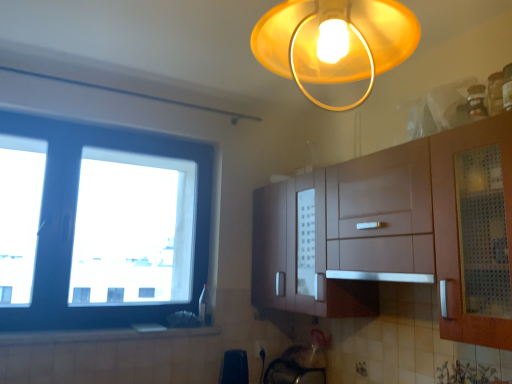
Where is `blue plastic window at left`? blue plastic window at left is located at coordinates (99, 224).

You are a GUI agent. You are given a task and a screenshot of the screen. Output one action in this format:
    pyautogui.click(x=<x>, y=<y>)
    Task: Click on the black plastic bag at lower center
    
    Given the screenshot: What is the action you would take?
    pyautogui.click(x=234, y=367)

In order to face white glossy electric outlet at lower center, should I rotate leftwards or rightwards?

Turn right approximately 0.881 degrees to face it.

The image size is (512, 384). What are the coordinates of `blue plastic window at left` in the screenshot? It's located at (99, 224).

Considering the relative sizes of matte yellow plastic lampshade at upper center and black plastic bag at lower center in the image provided, is matte yellow plastic lampshade at upper center smaller than black plastic bag at lower center?

No, matte yellow plastic lampshade at upper center is not smaller than black plastic bag at lower center.

Is matte yellow plastic lampshade at upper center surrounding black plastic bag at lower center?

No, matte yellow plastic lampshade at upper center does not contain black plastic bag at lower center.

Considering the sizes of objects matte yellow plastic lampshade at upper center and black plastic bag at lower center in the image provided, who is shorter, matte yellow plastic lampshade at upper center or black plastic bag at lower center?

black plastic bag at lower center is shorter.

Would you say white glossy electric outlet at lower center is inside or outside matte yellow plastic lampshade at upper center?

white glossy electric outlet at lower center is not inside matte yellow plastic lampshade at upper center, it's outside.

Is white glossy electric outlet at lower center looking in the opposite direction of matte yellow plastic lampshade at upper center?

No, white glossy electric outlet at lower center is not facing away from matte yellow plastic lampshade at upper center.

Which object is closer to the camera, white glossy electric outlet at lower center or matte yellow plastic lampshade at upper center?

matte yellow plastic lampshade at upper center is closer to the camera.

From the image's perspective, is white glossy electric outlet at lower center located above matte yellow plastic lampshade at upper center?

No.

Is black plastic bag at lower center closer to camera compared to satin silver exhaust hood at center?

No, it is not.

Based on the photo, could you tell me if black plastic bag at lower center is turned towards satin silver exhaust hood at center?

No, black plastic bag at lower center is not aimed at satin silver exhaust hood at center.

From a real-world perspective, is black plastic bag at lower center below satin silver exhaust hood at center?

Yes.

Considering the sizes of black plastic bag at lower center and satin silver exhaust hood at center in the image, is black plastic bag at lower center bigger or smaller than satin silver exhaust hood at center?

Considering their sizes, black plastic bag at lower center takes up less space than satin silver exhaust hood at center.

Which point is more forward, [264,22] or [31,342]?

The point [264,22] is more forward.

From the image's perspective, between matte yellow plastic lampshade at upper center and white glossy countertop at lower left, who is located below?

white glossy countertop at lower left, from the image's perspective.

Is matte yellow plastic lampshade at upper center oriented away from white glossy countertop at lower left?

No, matte yellow plastic lampshade at upper center is not facing the opposite direction of white glossy countertop at lower left.

Considering the sizes of objects blue plastic window at left and black plastic bag at lower center in the image provided, who is bigger, blue plastic window at left or black plastic bag at lower center?

Bigger between the two is blue plastic window at left.

Find the location of a particular element. window above the black plastic bag at lower center (from a real-world perspective) is located at coordinates (99, 224).

Based on the photo, can we say blue plastic window at left lies outside black plastic bag at lower center?

Yes, blue plastic window at left is outside of black plastic bag at lower center.

From the image's perspective, is blue plastic window at left located beneath black plastic bag at lower center?

Incorrect, from the image's perspective, blue plastic window at left is higher than black plastic bag at lower center.

How many degrees apart are the facing directions of white glossy countertop at lower left and white glossy electric outlet at lower center?

There is a 4.54-degree angle between the facing directions of white glossy countertop at lower left and white glossy electric outlet at lower center.

Locate an element on the screen. The width and height of the screenshot is (512, 384). counter top above the white glossy electric outlet at lower center (from the image's perspective) is located at coordinates pyautogui.click(x=99, y=335).

Is white glossy countertop at lower left spatially inside white glossy electric outlet at lower center, or outside of it?

white glossy countertop at lower left is not enclosed by white glossy electric outlet at lower center.

Could you measure the distance between white glossy countertop at lower left and white glossy electric outlet at lower center?

The distance of white glossy countertop at lower left from white glossy electric outlet at lower center is 29.12 inches.

Is matte yellow plastic lampshade at upper center positioned before white glossy electric outlet at lower center?

Yes, matte yellow plastic lampshade at upper center is in front of white glossy electric outlet at lower center.

Considering the relative sizes of matte yellow plastic lampshade at upper center and white glossy electric outlet at lower center in the image provided, is matte yellow plastic lampshade at upper center taller than white glossy electric outlet at lower center?

Indeed, matte yellow plastic lampshade at upper center has a greater height compared to white glossy electric outlet at lower center.

Is white glossy electric outlet at lower center at the back of matte yellow plastic lampshade at upper center?

No, matte yellow plastic lampshade at upper center is not facing the opposite direction of white glossy electric outlet at lower center.

Does matte yellow plastic lampshade at upper center have a greater width compared to white glossy electric outlet at lower center?

Yes.

The image size is (512, 384). Find the location of `lamp located on the right of black plastic bag at lower center`. lamp located on the right of black plastic bag at lower center is located at coordinates (335, 41).

At what (x,y) coordinates should I click in order to perform the action: click on electric outlet that appears on the left of matte yellow plastic lampshade at upper center. Please return your answer as a coordinate pair (x, y). Looking at the image, I should click on (260, 348).

Considering their positions, is matte yellow plastic lampshade at upper center positioned further to blue plastic window at left than white glossy countertop at lower left?

Based on the image, matte yellow plastic lampshade at upper center appears to be further to blue plastic window at left.

From the image, which object appears to be farther from blue plastic window at left, black plastic bag at lower center or white glossy countertop at lower left?

The object further to blue plastic window at left is black plastic bag at lower center.

Which object lies nearer to the anchor point white glossy electric outlet at lower center, blue plastic window at left or matte yellow plastic lampshade at upper center?

matte yellow plastic lampshade at upper center is closer to white glossy electric outlet at lower center.

Which object lies nearer to the anchor point white glossy countertop at lower left, black plastic bag at lower center or satin silver exhaust hood at center?

black plastic bag at lower center is positioned closer to the anchor white glossy countertop at lower left.

Looking at the image, which one is located further to black plastic bag at lower center, blue plastic window at left or satin silver exhaust hood at center?

blue plastic window at left lies further to black plastic bag at lower center than the other object.

Estimate the real-world distances between objects in this image. Which object is closer to white glossy electric outlet at lower center, black plastic bag at lower center or blue plastic window at left?

Among the two, black plastic bag at lower center is located nearer to white glossy electric outlet at lower center.

Considering their positions, is black plastic bag at lower center positioned closer to satin silver exhaust hood at center than matte yellow plastic lampshade at upper center?

The object closer to satin silver exhaust hood at center is black plastic bag at lower center.

Considering their positions, is white glossy countertop at lower left positioned closer to satin silver exhaust hood at center than black plastic bag at lower center?

black plastic bag at lower center is positioned closer to the anchor satin silver exhaust hood at center.

The width and height of the screenshot is (512, 384). I want to click on window between matte yellow plastic lampshade at upper center and white glossy electric outlet at lower center from front to back, so click(x=99, y=224).

Where is `counter top between blue plastic window at left and white glossy electric outlet at lower center from left to right`? The width and height of the screenshot is (512, 384). counter top between blue plastic window at left and white glossy electric outlet at lower center from left to right is located at coordinates (99, 335).

The height and width of the screenshot is (384, 512). In order to click on electric outlet between white glossy countertop at lower left and satin silver exhaust hood at center in the horizontal direction in this screenshot , I will do `click(260, 348)`.

You are a GUI agent. You are given a task and a screenshot of the screen. Output one action in this format:
    pyautogui.click(x=<x>, y=<y>)
    Task: Click on the exhaust hood between matte yellow plastic lampshade at upper center and black plastic bag at lower center in the front-back direction
    The height and width of the screenshot is (384, 512).
    Given the screenshot: What is the action you would take?
    pyautogui.click(x=381, y=276)